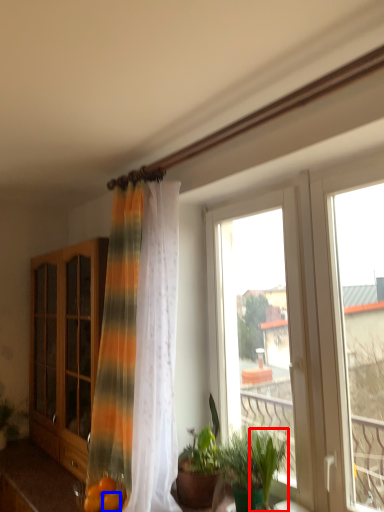
Question: Which point is further to the camera, plant (highlighted by a red box) or citrus fruit (highlighted by a blue box)?

Choices:
 (A) plant
 (B) citrus fruit

Answer: (B)